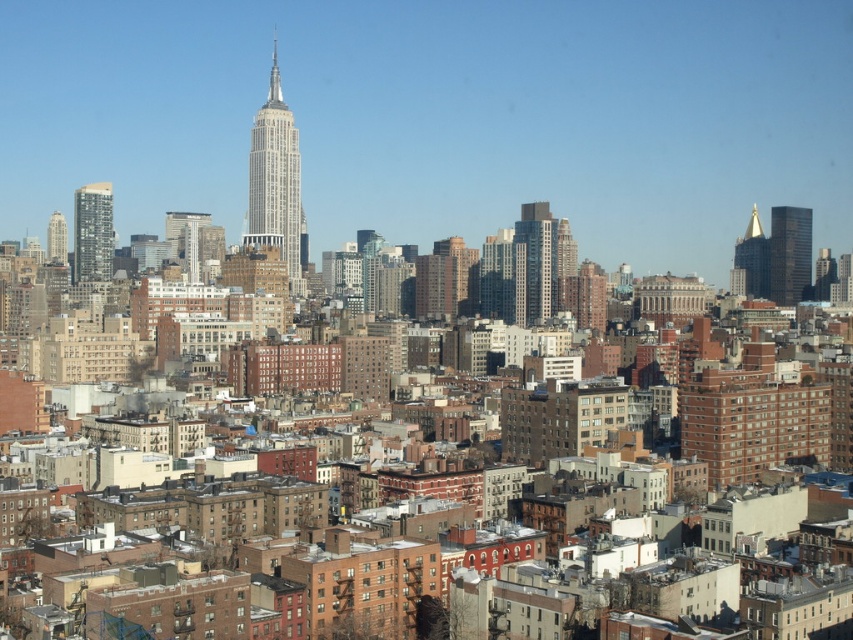
You are an urban planner reviewing this city layout. You need to identify the location of the matte glass skyscraper at left. According to the coordinate system where the bottom left corner is the origin, can you confirm if the point at (93, 232) is the correct location for the matte glass skyscraper at left?

Yes, the point at (93, 232) marks the location of the matte glass skyscraper at left as described.

You are an urban planner analyzing the skyline. You need to determine which of the two central skyscrapers, the polished steel skyscraper at center or the glassy silver skyscraper at center, has a greater horizontal span. Based on the provided information, which one is wider?

The polished steel skyscraper at center has a greater horizontal span because its width is larger than that of the glassy silver skyscraper at center.

You are an architect analyzing the urban skyline. You notice two skyscrapers at the center of the image. Which one appears closer to you when comparing the polished steel skyscraper at center and the glassy silver skyscraper at center?

The polished steel skyscraper at center appears closer to you because it is further to the viewer than the glassy silver skyscraper at center.